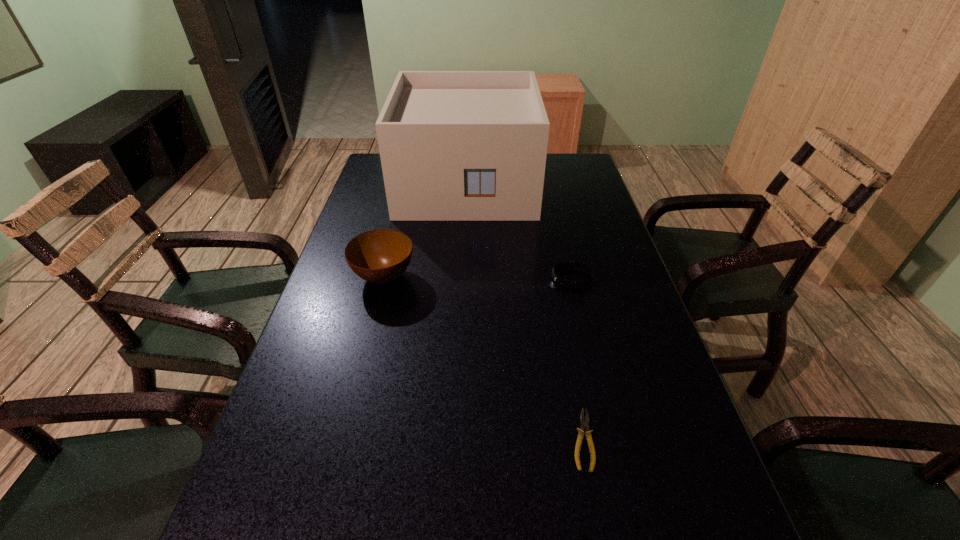
Where is `the third closest object to the wristband`? Image resolution: width=960 pixels, height=540 pixels. the third closest object to the wristband is located at coordinates (380, 256).

The image size is (960, 540). What are the coordinates of `free space in the image that satisfies the following two spatial constraints: 1. on the side of the pliers with the window; 2. on the left side of the box` in the screenshot? It's located at (455, 440).

I want to click on blank area in the image that satisfies the following two spatial constraints: 1. on the front side of the third shortest object; 2. on the left side of the shortest object, so click(344, 440).

This screenshot has height=540, width=960. Find the location of `vacant space that satisfies the following two spatial constraints: 1. on the side of the pliers with the window; 2. on the right side of the tallest object`. vacant space that satisfies the following two spatial constraints: 1. on the side of the pliers with the window; 2. on the right side of the tallest object is located at coordinates (455, 440).